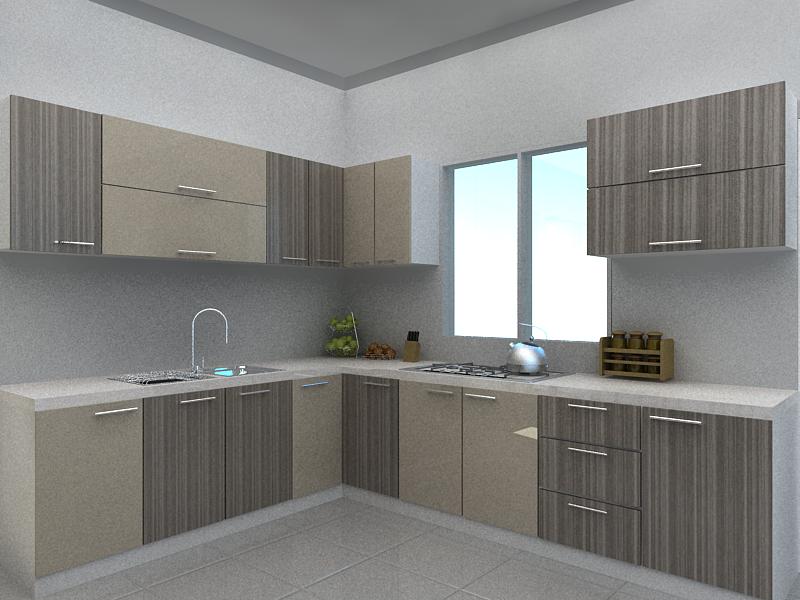
At what (x,y) coordinates should I click in order to perform the action: click on window. Please return your answer as a coordinate pair (x, y). Image resolution: width=800 pixels, height=600 pixels. Looking at the image, I should click on (482, 306).